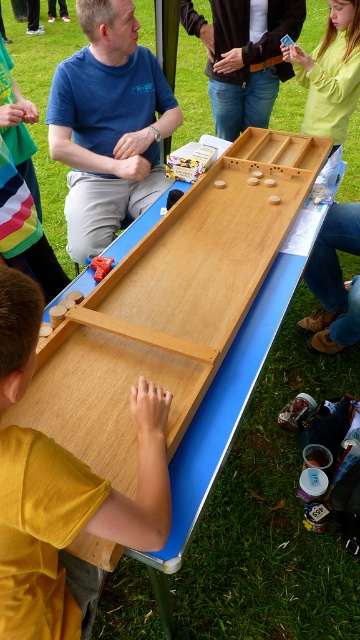
You are a photographer trying to capture a candid shot of the denim jeans at center and the light yellow sweater at upper right. To ensure both subjects are in frame, should you adjust your camera to focus more to the left or the right side of the current view?

The denim jeans at center is positioned on the left side of light yellow sweater at upper right, so you should focus more to the right side to include both subjects in the frame.

You are standing at the center of the shuffleboard table and want to hand a puck to the person wearing the light yellow sweater at upper right. In which direction should you move to reach them?

The light yellow sweater at upper right is located at point (330,72), so you should move towards the upper right direction to reach them.